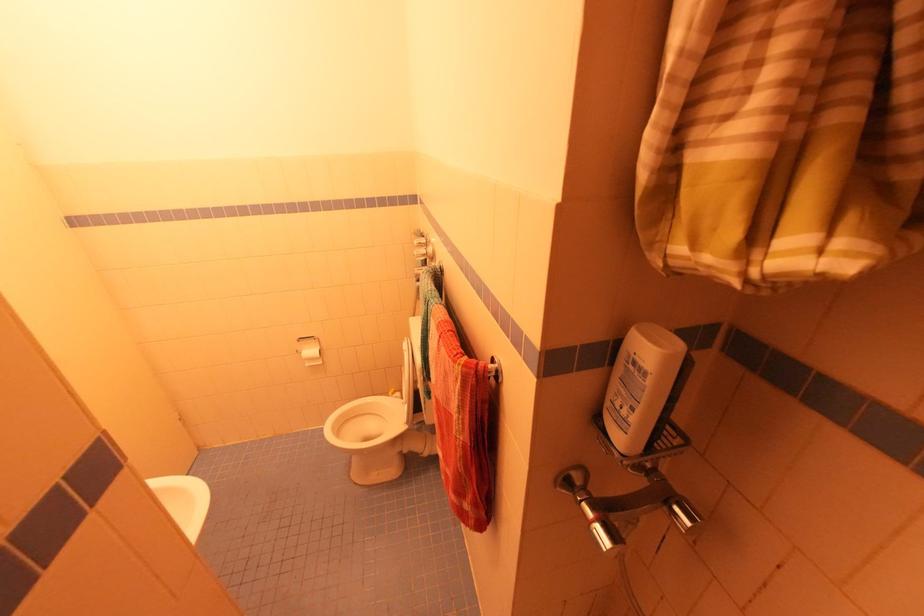
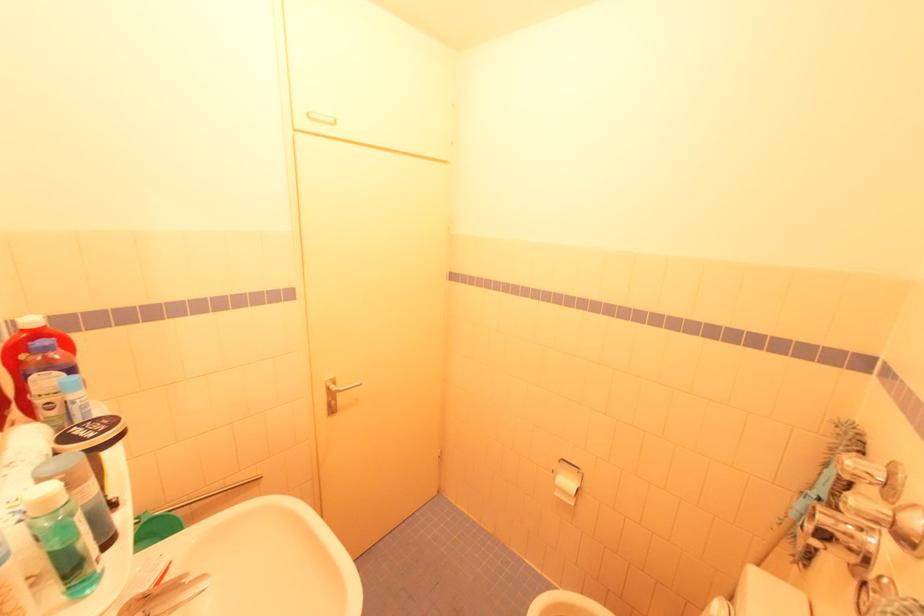
Question: The first image is from the beginning of the video and the second image is from the end. How did the camera likely rotate when shooting the video?

Choices:
 (A) Left
 (B) Right
 (C) Up
 (D) Down

Answer: (A)